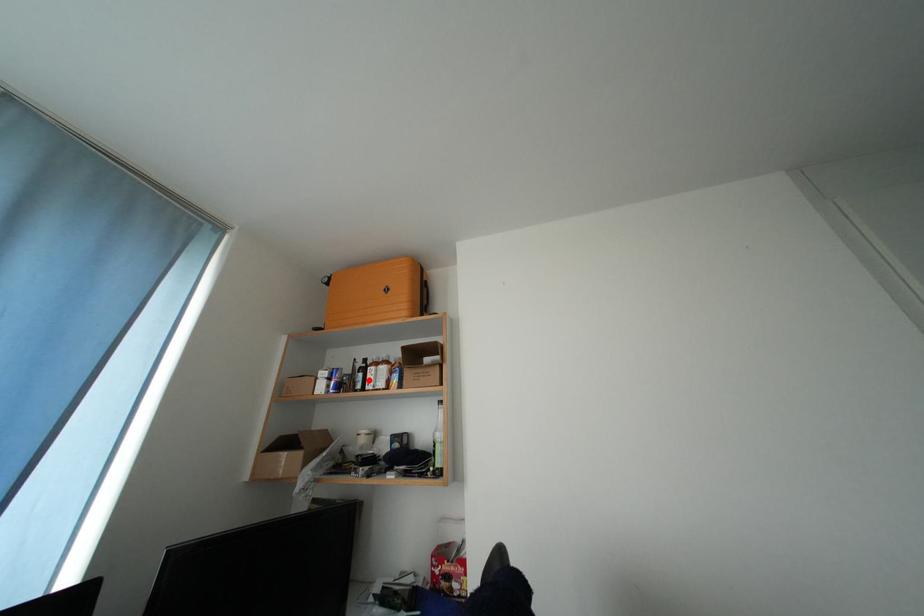
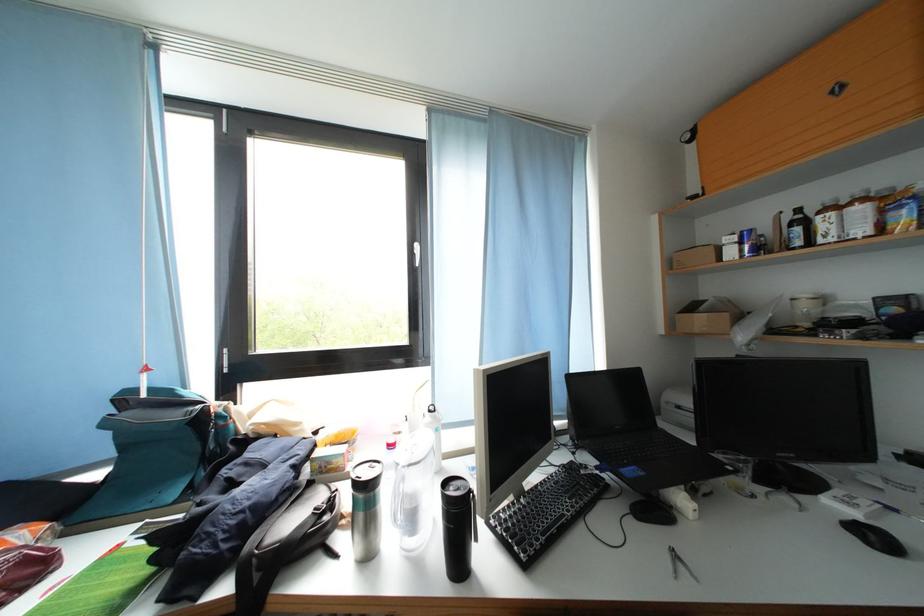
Locate, in the second image, the point that corresponds to the highlighted location in the first image.

(806, 233)